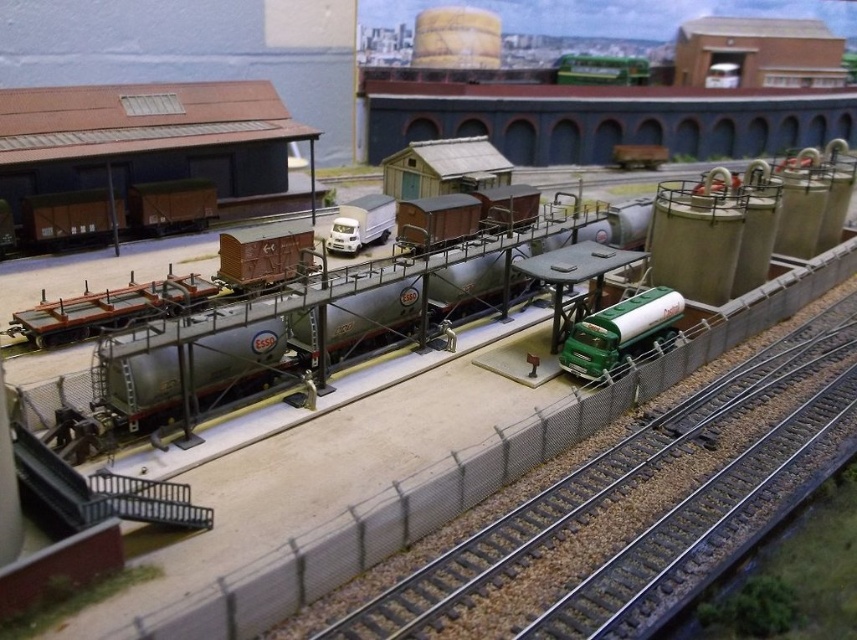
Who is more forward, (391,616) or (667,321)?

Point (391,616)

Does metallic gray train track at center have a greater width compared to green matte tanker truck at center-right?

Yes.

What do you see at coordinates (591, 490) in the screenshot?
I see `metallic gray train track at center` at bounding box center [591, 490].

At what (x,y) coordinates should I click in order to perform the action: click on metallic gray train track at center. Please return your answer as a coordinate pair (x, y). Looking at the image, I should click on (591, 490).

Is metallic gray train track at center wider than metallic silver tank car at center?

In fact, metallic gray train track at center might be narrower than metallic silver tank car at center.

Can you confirm if metallic gray train track at center is positioned below metallic silver tank car at center?

Correct, metallic gray train track at center is located below metallic silver tank car at center.

Does point (651, 464) come in front of point (297, 353)?

Yes, it is in front of point (297, 353).

Locate an element on the screen. The height and width of the screenshot is (640, 857). metallic gray train track at center is located at coordinates (591, 490).

You are a GUI agent. You are given a task and a screenshot of the screen. Output one action in this format:
    pyautogui.click(x=<x>, y=<y>)
    Task: Click on the metallic silver tank car at center
    This screenshot has height=640, width=857.
    Given the screenshot: What is the action you would take?
    pyautogui.click(x=252, y=356)

Can you confirm if metallic silver tank car at center is thinner than green matte tanker truck at center-right?

Incorrect, metallic silver tank car at center's width is not less than green matte tanker truck at center-right's.

At what (x,y) coordinates should I click in order to perform the action: click on metallic silver tank car at center. Please return your answer as a coordinate pair (x, y). The width and height of the screenshot is (857, 640). Looking at the image, I should click on (252, 356).